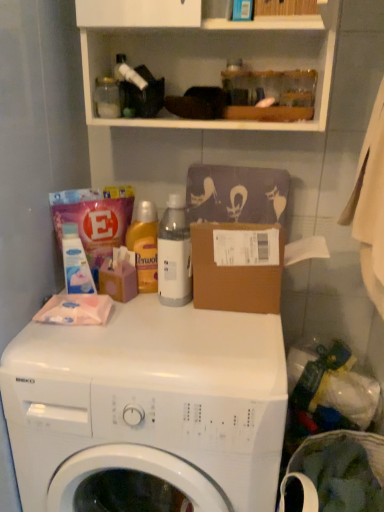
This screenshot has width=384, height=512. Find the location of `free space that is to the left of white plastic bottle at center`. free space that is to the left of white plastic bottle at center is located at coordinates [x=130, y=308].